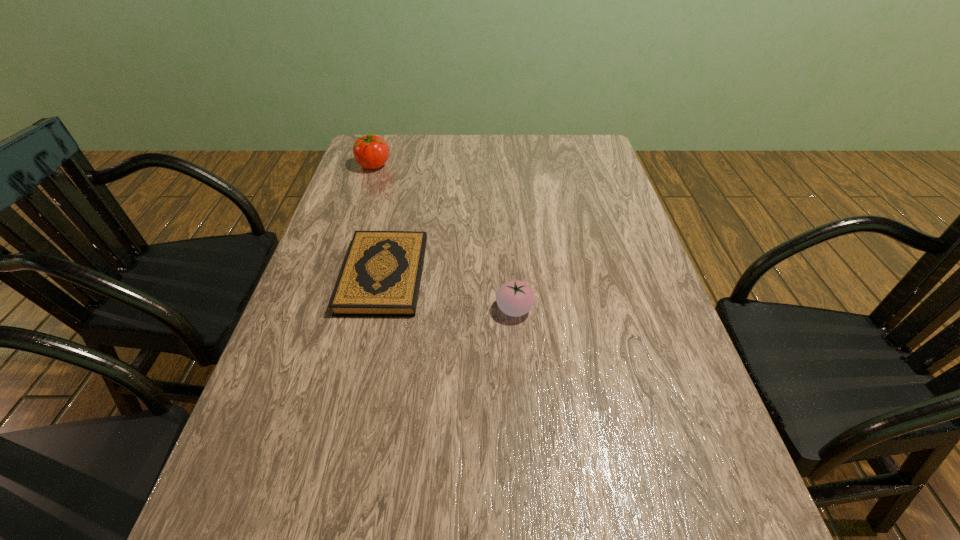
Where is `vacant area between the shortest object and the farther tomato`? The height and width of the screenshot is (540, 960). vacant area between the shortest object and the farther tomato is located at coordinates (379, 221).

Locate an element on the screen. The width and height of the screenshot is (960, 540). free space between the right tomato and the tallest object is located at coordinates (444, 238).

Identify the location of unoccupied position between the taller tomato and the nearer tomato. Image resolution: width=960 pixels, height=540 pixels. pos(444,238).

Image resolution: width=960 pixels, height=540 pixels. I want to click on free space that is in between the farther tomato and the hardback book, so click(x=379, y=221).

At what (x,y) coordinates should I click in order to perform the action: click on vacant region between the second tallest object and the shortest object. Please return your answer as a coordinate pair (x, y). The image size is (960, 540). Looking at the image, I should click on (449, 292).

Point out which object is positioned as the nearest to the shortest object. Please provide its 2D coordinates. Your answer should be formatted as a tuple, i.e. [(x, y)], where the tuple contains the x and y coordinates of a point satisfying the conditions above.

[(515, 298)]

Locate which object ranks second in proximity to the tallest object. Please provide its 2D coordinates. Your answer should be formatted as a tuple, i.e. [(x, y)], where the tuple contains the x and y coordinates of a point satisfying the conditions above.

[(515, 298)]

Where is `free space that satisfies the following two spatial constraints: 1. on the front side of the hardback book; 2. on the left side of the farthest object`? free space that satisfies the following two spatial constraints: 1. on the front side of the hardback book; 2. on the left side of the farthest object is located at coordinates (337, 275).

Find the location of a particular element. Image resolution: width=960 pixels, height=540 pixels. vacant point that satisfies the following two spatial constraints: 1. on the front side of the hardback book; 2. on the right side of the shorter tomato is located at coordinates (376, 309).

Identify the location of free space that satisfies the following two spatial constraints: 1. on the front side of the shortest object; 2. on the left side of the rightmost object. (376, 309).